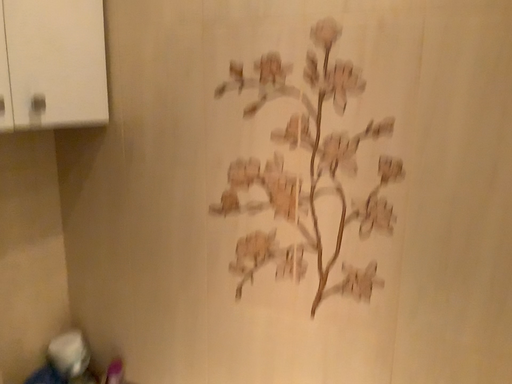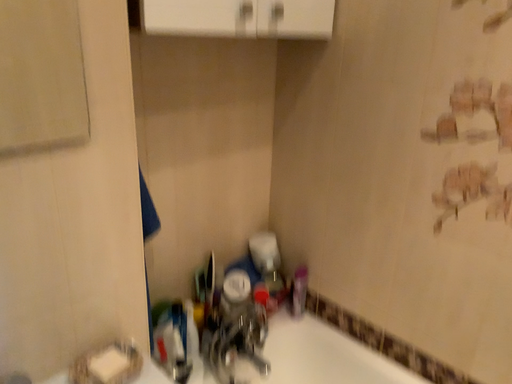
Question: Which way did the camera rotate in the video?

Choices:
 (A) rotated right
 (B) rotated left

Answer: (B)